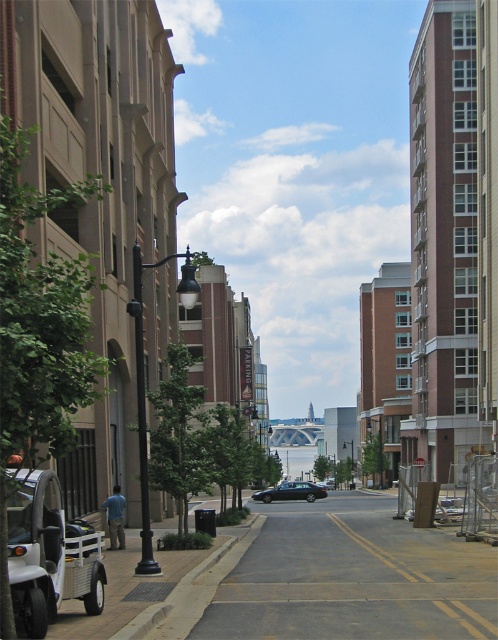
Question: Can you confirm if gray asphalt road at center is positioned below shiny black sedan at center?

Choices:
 (A) yes
 (B) no

Answer: (B)

Question: Is gray asphalt road at center to the right of shiny black sedan at center from the viewer's perspective?

Choices:
 (A) yes
 (B) no

Answer: (B)

Question: Among these objects, which one is farthest from the camera?

Choices:
 (A) shiny black sedan at center
 (B) gray asphalt road at center

Answer: (A)

Question: Which object appears farthest from the camera in this image?

Choices:
 (A) gray asphalt road at center
 (B) shiny black sedan at center

Answer: (B)

Question: Can you confirm if gray asphalt road at center is positioned to the right of shiny black sedan at center?

Choices:
 (A) no
 (B) yes

Answer: (A)

Question: Among these objects, which one is farthest from the camera?

Choices:
 (A) gray asphalt road at center
 (B) shiny black sedan at center

Answer: (B)